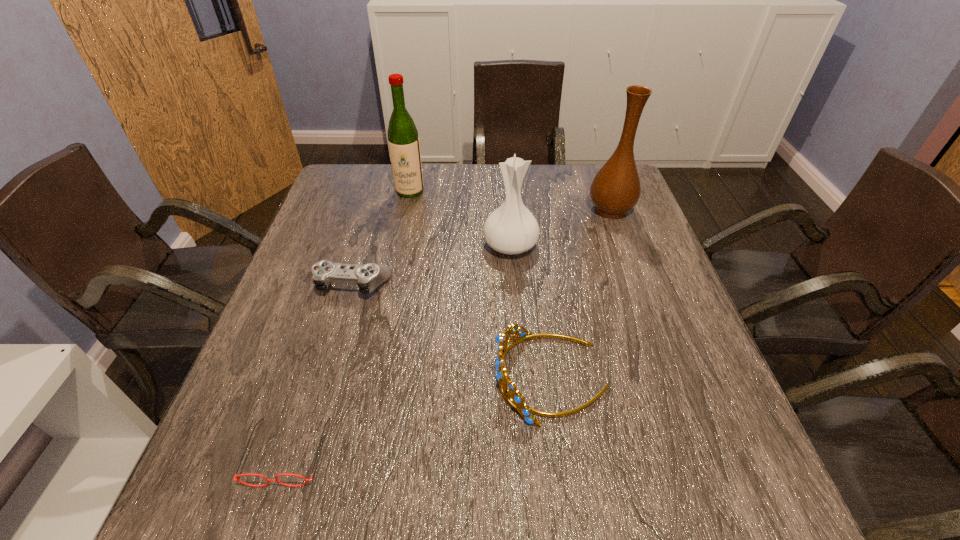
This screenshot has height=540, width=960. Find the location of `spectacles that is at the left edge`. spectacles that is at the left edge is located at coordinates (268, 480).

Where is `object situated at the right edge`? object situated at the right edge is located at coordinates (616, 189).

The width and height of the screenshot is (960, 540). What are the coordinates of `object that is positioned at the near left corner` in the screenshot? It's located at (268, 480).

The image size is (960, 540). I want to click on object present at the far right corner, so click(616, 189).

This screenshot has width=960, height=540. Identify the location of free spot at the left edge of the desktop. (245, 396).

The width and height of the screenshot is (960, 540). In order to click on blank space at the right edge of the desktop in this screenshot , I will do `click(649, 434)`.

You are a GUI agent. You are given a task and a screenshot of the screen. Output one action in this format:
    pyautogui.click(x=<x>, y=<y>)
    Task: Click on the vacant space at the far left corner of the desktop
    The width and height of the screenshot is (960, 540).
    Given the screenshot: What is the action you would take?
    pyautogui.click(x=330, y=193)

This screenshot has width=960, height=540. I want to click on free space at the near left corner of the desktop, so click(272, 488).

Find the location of a particular element. The image size is (960, 540). vacant space at the far right corner is located at coordinates (580, 183).

This screenshot has width=960, height=540. Find the location of `free space at the near right corner of the desktop`. free space at the near right corner of the desktop is located at coordinates pyautogui.click(x=765, y=483).